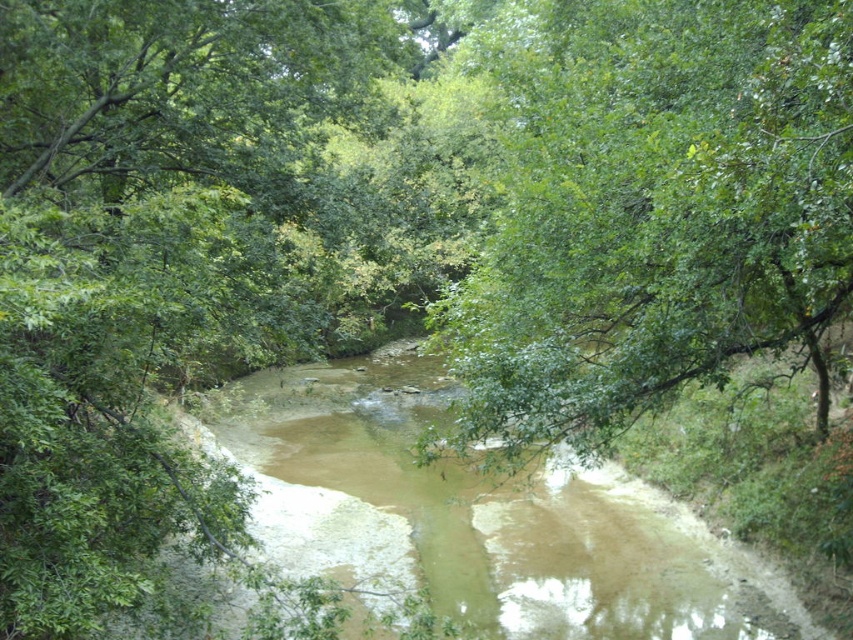
Can you confirm if green leafy tree at center is smaller than brown sedimentary water at center?

No, green leafy tree at center is not smaller than brown sedimentary water at center.

This screenshot has width=853, height=640. In order to click on green leafy tree at center in this screenshot , I will do `click(653, 211)`.